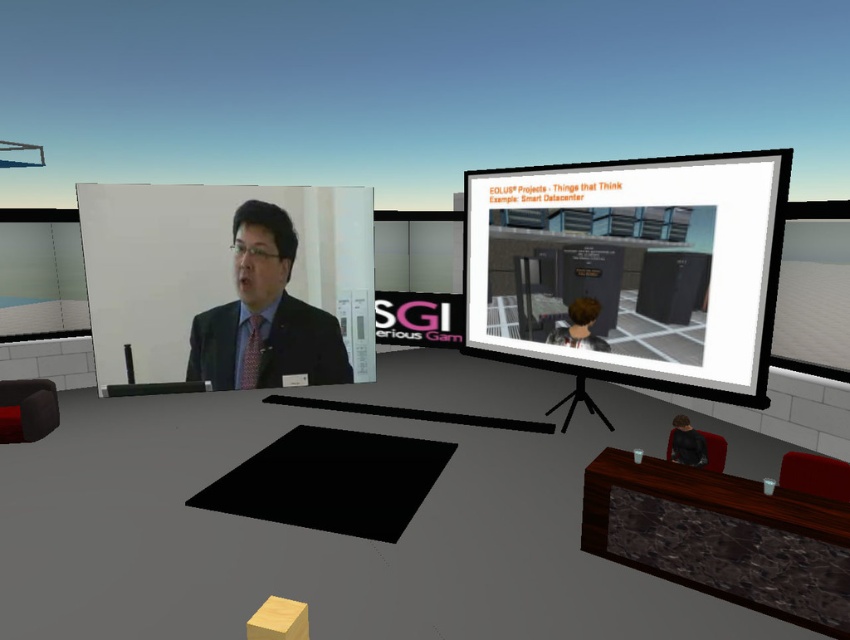
Question: Considering the relative positions of matte black suit at center and pink satin tie at center in the image provided, where is matte black suit at center located with respect to pink satin tie at center?

Choices:
 (A) left
 (B) right

Answer: (B)

Question: Which point appears closest to the camera in this image?

Choices:
 (A) (x=683, y=294)
 (B) (x=256, y=253)
 (C) (x=244, y=388)

Answer: (B)

Question: Does light brown hair at upper center have a larger size compared to pink satin tie at center?

Choices:
 (A) no
 (B) yes

Answer: (B)

Question: Which is farther from the pink satin tie at center?

Choices:
 (A) light brown hair at upper center
 (B) matte black suit at center

Answer: (A)

Question: Is light brown hair at upper center further to the viewer compared to pink satin tie at center?

Choices:
 (A) no
 (B) yes

Answer: (B)

Question: Among these objects, which one is nearest to the camera?

Choices:
 (A) matte black suit at center
 (B) pink satin tie at center

Answer: (A)